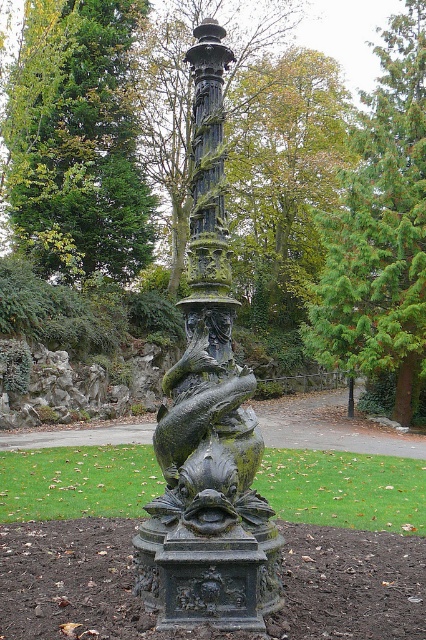
Question: Can you confirm if green leafy tree at center is positioned to the right of bronze textured column at center?

Choices:
 (A) yes
 (B) no

Answer: (B)

Question: Which object is the farthest from the green patina column at center?

Choices:
 (A) bronze textured column at center
 (B) green textured tree at upper center

Answer: (B)

Question: Which object appears farthest from the camera in this image?

Choices:
 (A) green patina column at center
 (B) green textured tree at upper center
 (C) bronze textured column at center

Answer: (B)

Question: Which object is the closest to the bronze textured column at center?

Choices:
 (A) green textured tree at upper center
 (B) green patina column at center
 (C) green leafy tree at center

Answer: (B)

Question: In this image, where is green patina column at center located relative to green leafy tree at center?

Choices:
 (A) above
 (B) below

Answer: (B)

Question: Considering the relative positions of green patina column at center and green leafy tree at center in the image provided, where is green patina column at center located with respect to green leafy tree at center?

Choices:
 (A) right
 (B) left

Answer: (A)